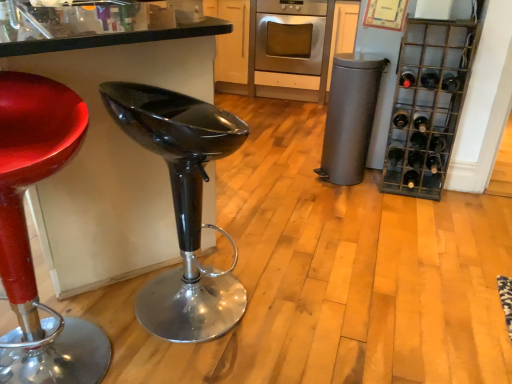
Where is `free spot in front of gray matte trash can at center-right`? The height and width of the screenshot is (384, 512). free spot in front of gray matte trash can at center-right is located at coordinates (352, 200).